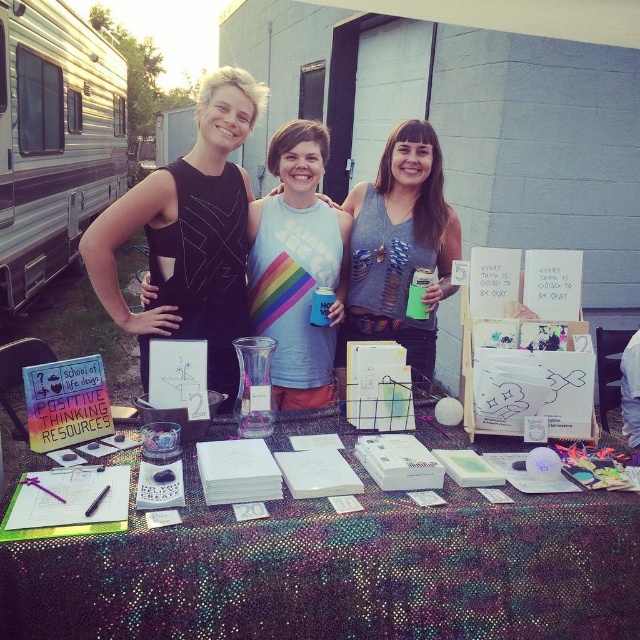
Question: Can you confirm if white paper at center is positioned to the left of silver metallic recreational vehicle at left?

Choices:
 (A) no
 (B) yes

Answer: (A)

Question: Which of the following is the closest to the observer?

Choices:
 (A) white paper at center
 (B) silver metallic recreational vehicle at left

Answer: (A)

Question: Does white paper at center have a lesser width compared to silver metallic recreational vehicle at left?

Choices:
 (A) no
 (B) yes

Answer: (A)

Question: Which point appears closest to the camera in this image?

Choices:
 (A) (432, 525)
 (B) (376, 320)
 (C) (113, 45)

Answer: (A)

Question: Is white paper at center bigger than grayholey tank top at center?

Choices:
 (A) no
 (B) yes

Answer: (B)

Question: Which object appears closest to the camera in this image?

Choices:
 (A) white paper at center
 (B) grayholey tank top at center
 (C) silver metallic recreational vehicle at left

Answer: (A)